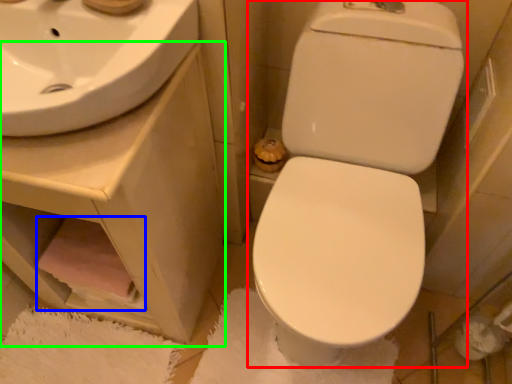
Question: Considering the real-world distances, which object is closest to toilet (highlighted by a red box)? toilet paper (highlighted by a blue box) or counter top (highlighted by a green box).

Choices:
 (A) toilet paper
 (B) counter top

Answer: (B)